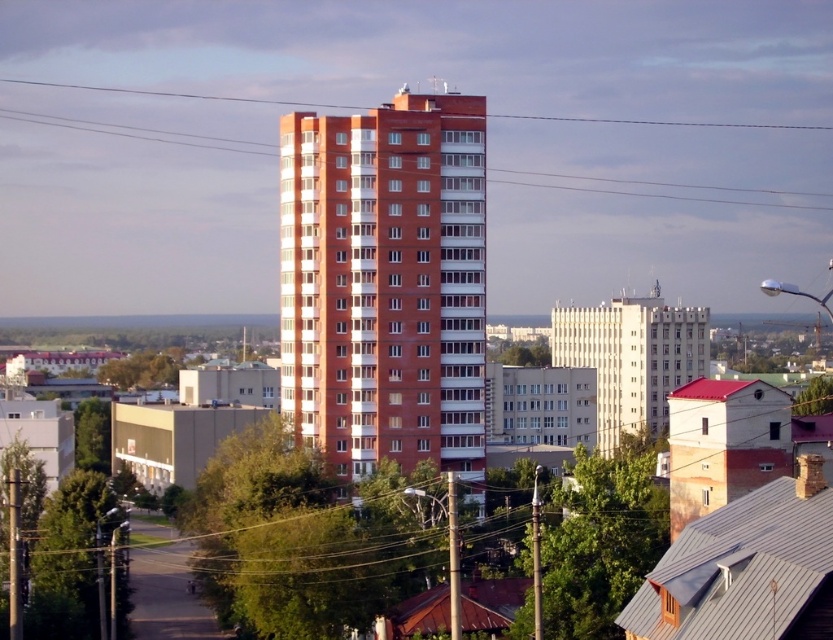
Question: Does brick building at center have a smaller size compared to white smooth building at center?

Choices:
 (A) yes
 (B) no

Answer: (B)

Question: Which point is closer to the camera?

Choices:
 (A) (620, 310)
 (B) (300, 400)

Answer: (B)

Question: From the image, what is the correct spatial relationship of brick building at center in relation to white smooth building at center?

Choices:
 (A) right
 (B) left

Answer: (B)

Question: Which point is closer to the camera?

Choices:
 (A) (697, 307)
 (B) (342, 364)

Answer: (B)

Question: Is brick building at center further to camera compared to white smooth building at center?

Choices:
 (A) yes
 (B) no

Answer: (B)

Question: Which object is farther from the camera taking this photo?

Choices:
 (A) white smooth building at center
 (B) brick building at center

Answer: (A)